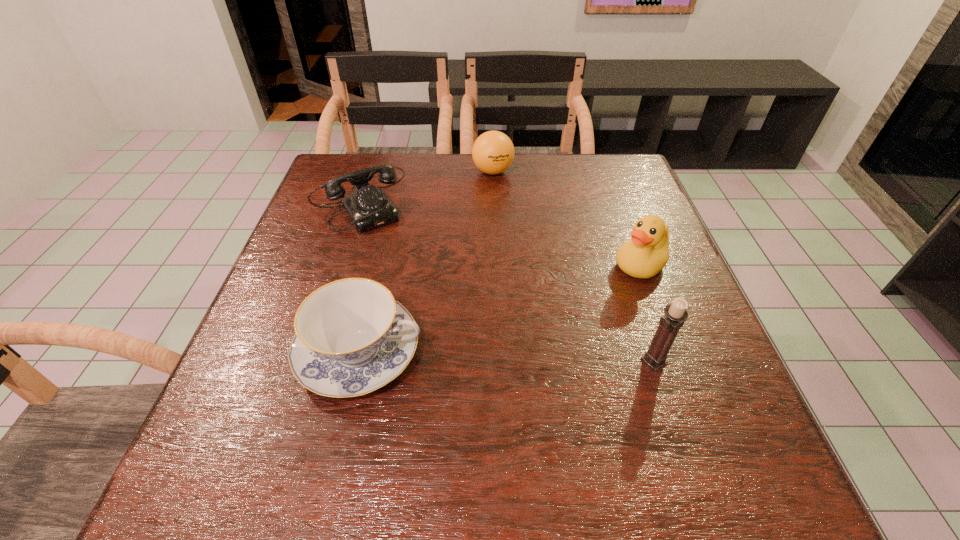
Where is `free point between the third object from right to left and the chinaware`? The height and width of the screenshot is (540, 960). free point between the third object from right to left and the chinaware is located at coordinates (426, 262).

In order to click on unoccupied position between the telephone and the chinaware in this screenshot , I will do `click(362, 275)`.

The width and height of the screenshot is (960, 540). Find the location of `vacant space in between the third object from right to left and the telephone`. vacant space in between the third object from right to left and the telephone is located at coordinates (428, 184).

Identify which object is the second nearest to the third nearest object. Please provide its 2D coordinates. Your answer should be formatted as a tuple, i.e. [(x, y)], where the tuple contains the x and y coordinates of a point satisfying the conditions above.

[(493, 152)]

Identify which object is located as the third nearest to the third object from left to right. Please provide its 2D coordinates. Your answer should be formatted as a tuple, i.e. [(x, y)], where the tuple contains the x and y coordinates of a point satisfying the conditions above.

[(351, 338)]

Where is `blank area in the image that satisfies the following two spatial constraints: 1. on the back side of the third object from right to left; 2. on the left side of the telephone`? The height and width of the screenshot is (540, 960). blank area in the image that satisfies the following two spatial constraints: 1. on the back side of the third object from right to left; 2. on the left side of the telephone is located at coordinates (372, 171).

Where is `free spot that satisfies the following two spatial constraints: 1. on the front side of the candle holder; 2. on the right side of the telephone`? free spot that satisfies the following two spatial constraints: 1. on the front side of the candle holder; 2. on the right side of the telephone is located at coordinates (311, 361).

This screenshot has width=960, height=540. Find the location of `free spot that satisfies the following two spatial constraints: 1. on the front side of the ping-pong ball; 2. on the right side of the second tallest object`. free spot that satisfies the following two spatial constraints: 1. on the front side of the ping-pong ball; 2. on the right side of the second tallest object is located at coordinates (496, 266).